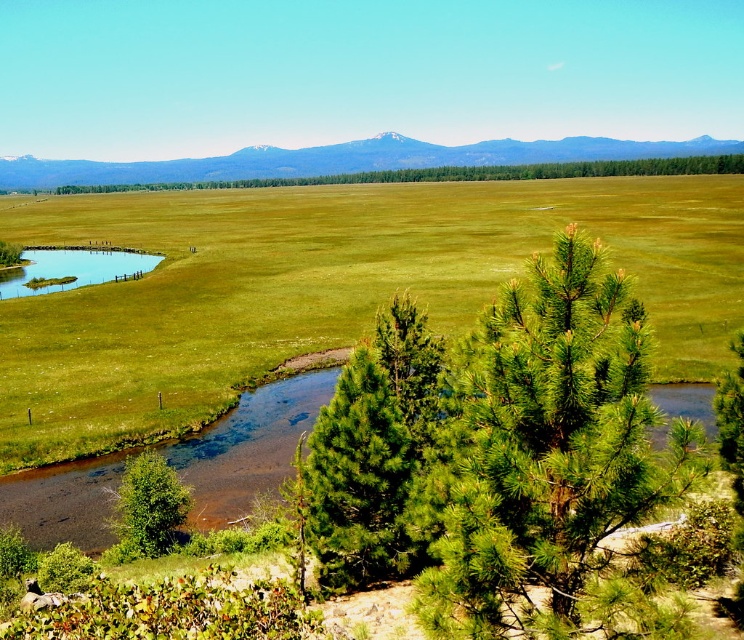
You are standing in the middle of the grassland and see two points marked in the image. Which point, point (x=612, y=496) or point (x=166, y=499), is closer to you?

Point (x=612, y=496) is closer to you than point (x=166, y=499).